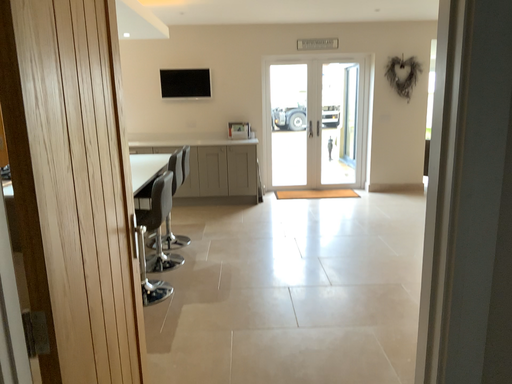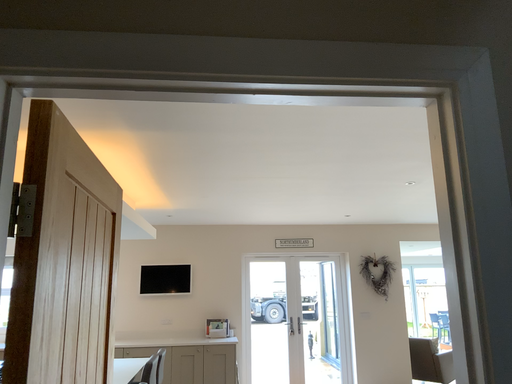
Question: Which way did the camera rotate in the video?

Choices:
 (A) rotated upward
 (B) rotated downward

Answer: (A)